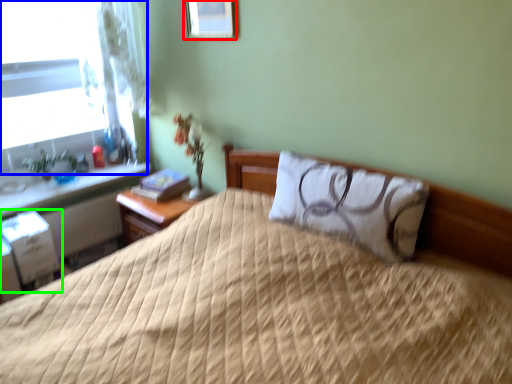
Question: Based on their relative distances, which object is farther from picture frame (highlighted by a red box)? Choose from window (highlighted by a blue box) and file cabinet (highlighted by a green box).

Choices:
 (A) window
 (B) file cabinet

Answer: (B)